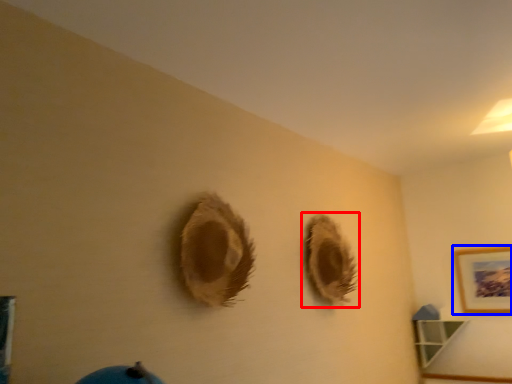
Question: Among these objects, which one is nearest to the camera, hole (highlighted by a red box) or picture frame (highlighted by a blue box)?

Choices:
 (A) hole
 (B) picture frame

Answer: (A)